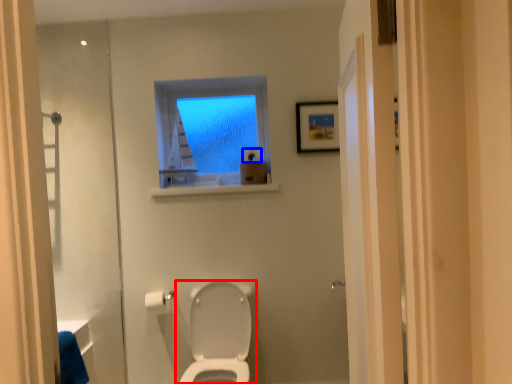
Question: Which object appears closest to the camera in this image, toilet (highlighted by a red box) or toilet paper (highlighted by a blue box)?

Choices:
 (A) toilet
 (B) toilet paper

Answer: (A)